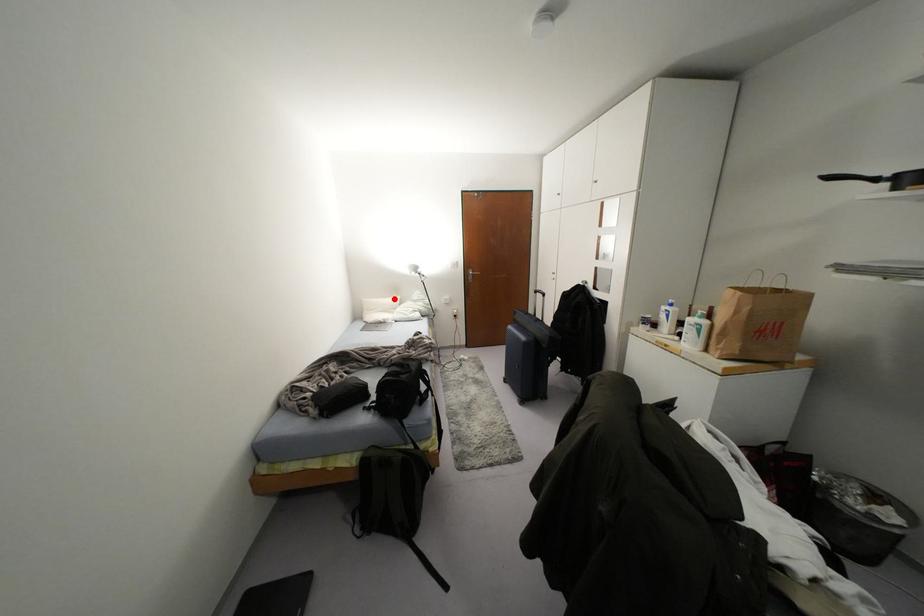
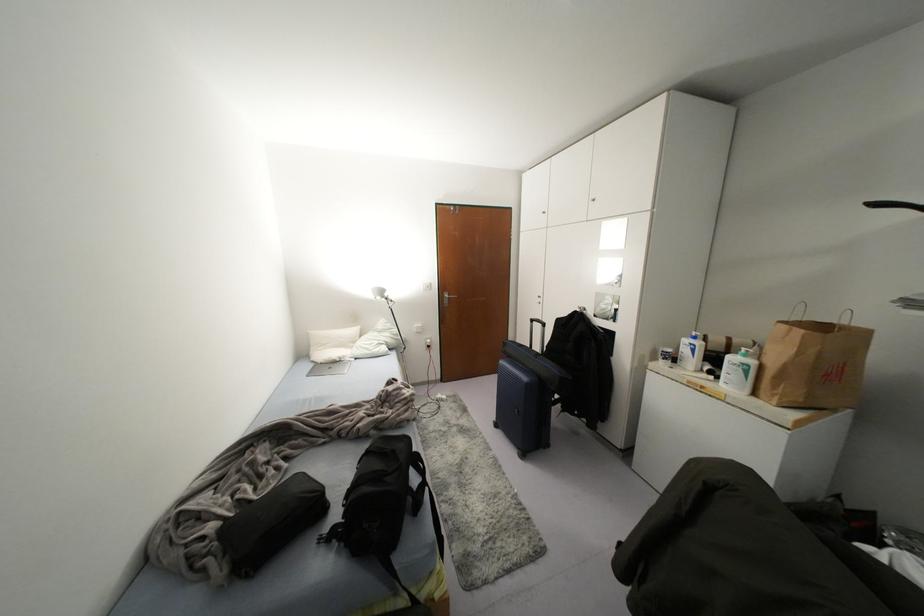
Locate, in the second image, the point that corresponds to the highlighted location in the first image.

(354, 330)